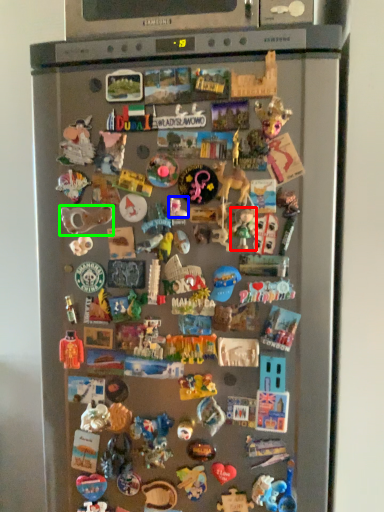
Question: Which object is the farthest from toy (highlighted by a red box)? Choose among these: toy (highlighted by a blue box) or toy (highlighted by a green box).

Choices:
 (A) toy
 (B) toy

Answer: (B)